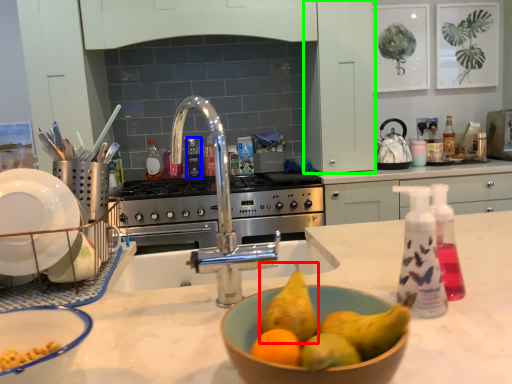
Question: Which object is the farthest from pear (highlighted by a red box)? Choose among these: bottle (highlighted by a blue box) or cabinetry (highlighted by a green box).

Choices:
 (A) bottle
 (B) cabinetry

Answer: (A)